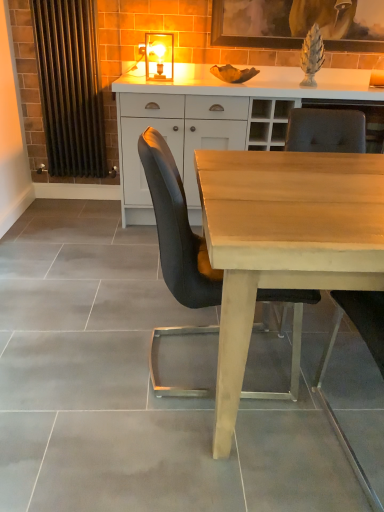
Question: Considering the relative sizes of matte black chair at center, which ranks as the first chair in left-to-right order, and white matte cabinet at center in the image provided, is matte black chair at center, which ranks as the first chair in left-to-right order, shorter than white matte cabinet at center?

Choices:
 (A) yes
 (B) no

Answer: (A)

Question: From the image's perspective, is matte black chair at center, the second chair in the right-to-left sequence, below white matte cabinet at center?

Choices:
 (A) no
 (B) yes

Answer: (B)

Question: Is matte black chair at center, which ranks as the first chair in left-to-right order, outside white matte cabinet at center?

Choices:
 (A) yes
 (B) no

Answer: (A)

Question: Is matte black chair at center, the second chair in the right-to-left sequence, to the right of white matte cabinet at center from the viewer's perspective?

Choices:
 (A) no
 (B) yes

Answer: (B)

Question: Is matte black chair at center, the second chair in the right-to-left sequence, at the left side of white matte cabinet at center?

Choices:
 (A) yes
 (B) no

Answer: (B)

Question: Visually, is matte glass lampshade at upper center positioned to the left or to the right of matte wood chair at center, the 1th chair from the right?

Choices:
 (A) left
 (B) right

Answer: (A)

Question: Considering the positions of matte glass lampshade at upper center and matte wood chair at center, which is the second chair from left to right, in the image, is matte glass lampshade at upper center wider or thinner than matte wood chair at center, which is the second chair from left to right,?

Choices:
 (A) wide
 (B) thin

Answer: (B)

Question: Choose the correct answer: Is matte glass lampshade at upper center inside matte wood chair at center, the 1th chair from the right, or outside it?

Choices:
 (A) inside
 (B) outside

Answer: (B)

Question: In the image, is matte glass lampshade at upper center positioned in front of or behind matte wood chair at center, the 1th chair from the right?

Choices:
 (A) behind
 (B) front

Answer: (A)

Question: From their relative heights in the image, would you say matte wood chair at center, which is the second chair from left to right, is taller or shorter than white matte cabinet at center?

Choices:
 (A) tall
 (B) short

Answer: (B)

Question: Visually, is matte wood chair at center, the 1th chair from the right, positioned to the left or to the right of white matte cabinet at center?

Choices:
 (A) right
 (B) left

Answer: (A)

Question: Choose the correct answer: Is matte wood chair at center, the 1th chair from the right, inside white matte cabinet at center or outside it?

Choices:
 (A) outside
 (B) inside

Answer: (A)

Question: Does point (332, 116) appear closer or farther from the camera than point (192, 73)?

Choices:
 (A) closer
 (B) farther

Answer: (A)

Question: Does point (244, 15) appear closer or farther from the camera than point (59, 27)?

Choices:
 (A) closer
 (B) farther

Answer: (B)

Question: Is wooden picture frame at upper center taller or shorter than metallic radiator at left?

Choices:
 (A) short
 (B) tall

Answer: (A)